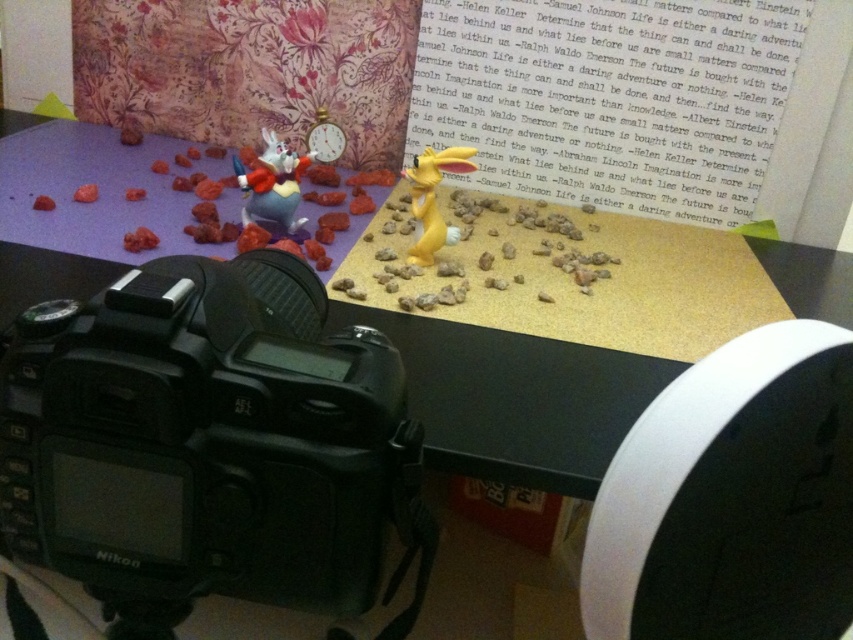
Which of these two, black plastic camera at lower left or matte plastic rabbit at upper left, stands shorter?

matte plastic rabbit at upper left

At what (x,y) coordinates should I click in order to perform the action: click on black plastic camera at lower left. Please return your answer as a coordinate pair (x, y). This screenshot has width=853, height=640. Looking at the image, I should click on (209, 444).

Identify the location of black plastic camera at lower left. The height and width of the screenshot is (640, 853). (209, 444).

Which is below, matte plastic rabbit at upper left or yellow matte rabbit at center?

yellow matte rabbit at center

Can you confirm if matte plastic rabbit at upper left is shorter than yellow matte rabbit at center?

Indeed, matte plastic rabbit at upper left has a lesser height compared to yellow matte rabbit at center.

The image size is (853, 640). Describe the element at coordinates (271, 182) in the screenshot. I see `matte plastic rabbit at upper left` at that location.

Locate an element on the screen. This screenshot has height=640, width=853. matte plastic rabbit at upper left is located at coordinates (271, 182).

Is point (80, 445) more distant than point (469, 170)?

No, (80, 445) is closer to viewer.

Where is `black plastic camera at lower left`? The image size is (853, 640). black plastic camera at lower left is located at coordinates (209, 444).

Identify the location of black plastic camera at lower left. (209, 444).

The height and width of the screenshot is (640, 853). I want to click on black plastic camera at lower left, so click(x=209, y=444).